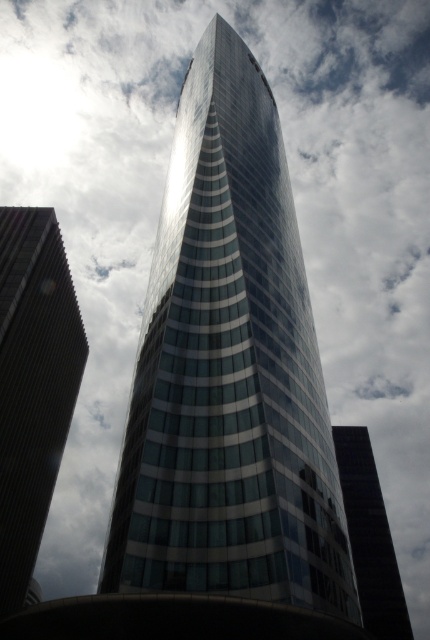
You are a drone operator tasked with flying a drone between two skyscrapers. The drone has a wingspan of 1.5 meters. You need to fly it through the gap between the matte glass skyscraper at left and the glassy reflective skyscraper at center. Is the gap wide enough for the drone to pass safely?

The matte glass skyscraper at left is 48.36 meters away from the glassy reflective skyscraper at center. Since the gap is much wider than the drone wingspan of 1.5 meters, the drone can safely pass through the gap between them.

You are standing in front of the curved skyscraper and notice two points marked on its facade. The first point is at coordinates point (37, 243) and the second is at point (372, 513). Which point is closer to you?

Point (37, 243) is closer to the viewer than point (372, 513).

You are standing in front of the curved skyscraper and want to take a photo of a specific point on its facade. The point you want to capture is labeled as point (14, 333). If your camera can focus on objects within 60 meters, will you be able to capture this point clearly?

The distance of point (14, 333) from the camera is 63.21 meters, which is beyond the camera focus range of 60 meters. Therefore, the point will not be captured clearly.